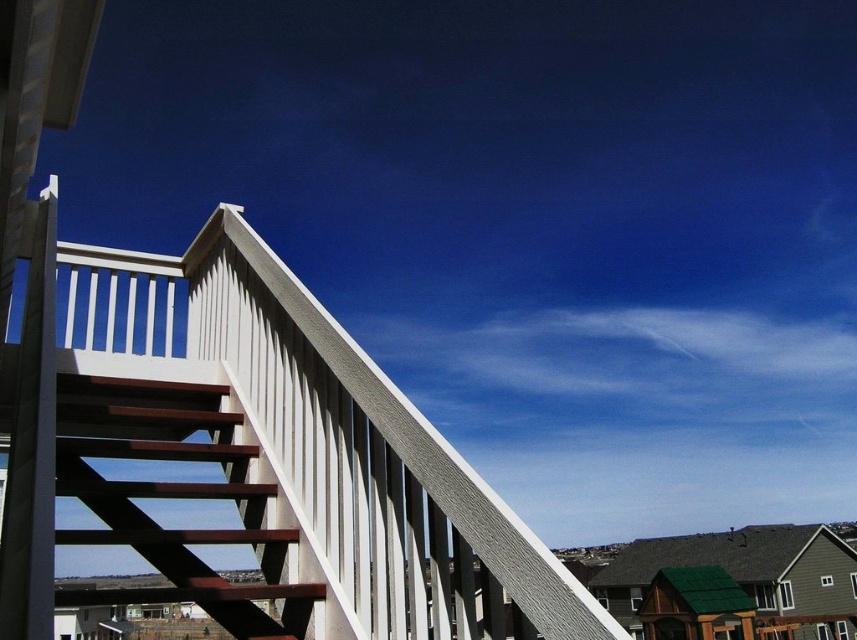
Is white textured porch at upper left below brown wooden stairs at upper left?

No.

Between white textured porch at upper left and brown wooden stairs at upper left, which one has less height?

With less height is brown wooden stairs at upper left.

What do you see at coordinates (252, 460) in the screenshot? I see `white textured porch at upper left` at bounding box center [252, 460].

Locate an element on the screen. The width and height of the screenshot is (857, 640). white textured porch at upper left is located at coordinates (252, 460).